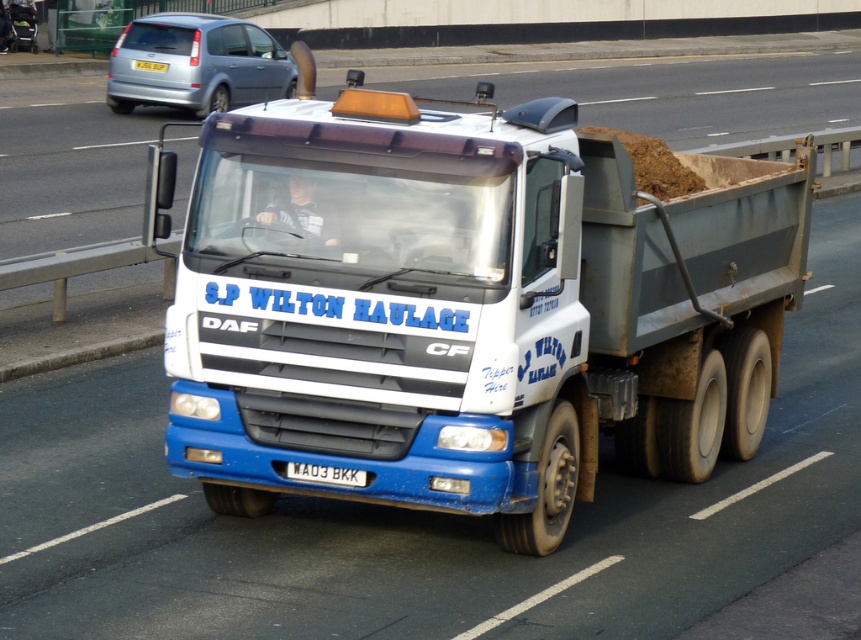
You are standing at the point labeled point [153,26] and want to walk to the point labeled point [679,282]. Which direction should you face to walk towards your destination?

You should face north because point [679,282] is in front of point [153,26].

You are a traffic officer checking license plates. You see the white metallic license plate at center and the white plastic license plate at center on the truck. Which license plate is shorter in height?

The white metallic license plate at center is not as tall as the white plastic license plate at center, so the white metallic license plate at center is shorter in height.

You are a traffic officer observing the road. You notice the blue matte truck at center and the metallic silver van at upper left. Which vehicle is taller?

The metallic silver van at upper left is taller than the blue matte truck at center.